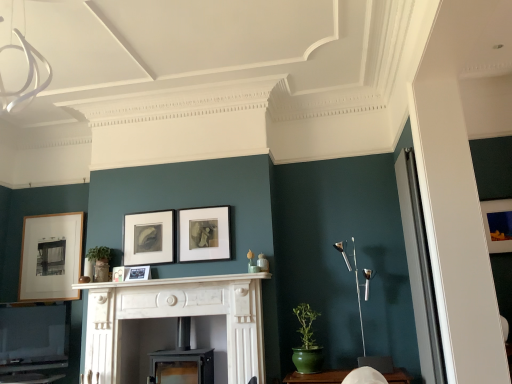
What do you see at coordinates (119, 274) in the screenshot?
I see `matte black picture frame at center, which is counted as the second picture frame, starting from the left` at bounding box center [119, 274].

Describe the element at coordinates (138, 273) in the screenshot. Image resolution: width=512 pixels, height=384 pixels. I see `matte black picture frame at center, the third picture frame viewed from the left` at that location.

How much space does matte black picture frame at center, positioned as the fourth picture frame in left-to-right order, occupy horizontally?

1.71 inches.

You are a GUI agent. You are given a task and a screenshot of the screen. Output one action in this format:
    pyautogui.click(x=<x>, y=<y>)
    Task: Click on the green ceramic table at lower center
    This screenshot has width=512, height=384.
    Given the screenshot: What is the action you would take?
    pyautogui.click(x=316, y=377)

Which point is more forward, (96, 380) or (150, 277)?

The point (96, 380) is closer to the camera.

From the picture: Is white marble fireplace at center, arranged as the first fireplace when viewed from the left, facing away from matte black picture frame at center, the third picture frame viewed from the left?

No, white marble fireplace at center, arranged as the first fireplace when viewed from the left, is not facing away from matte black picture frame at center, the third picture frame viewed from the left.

How different are the orientations of white marble fireplace at center, arranged as the first fireplace when viewed from the left, and matte black picture frame at center, the third picture frame viewed from the left, in degrees?

The angle between the facing direction of white marble fireplace at center, arranged as the first fireplace when viewed from the left, and the facing direction of matte black picture frame at center, the third picture frame viewed from the left, is 2.35 degrees.

In the scene shown: From the image's perspective, which one is positioned lower, white marble fireplace at center, arranged as the first fireplace when viewed from the left, or matte black picture frame at center, the third picture frame viewed from the left?

white marble fireplace at center, arranged as the first fireplace when viewed from the left, from the image's perspective.

This screenshot has width=512, height=384. What are the coordinates of `the 5th picture frame behind when counting from the white marble fireplace at center, the 2th fireplace when ordered from right to left` in the screenshot? It's located at (148, 238).

Does point (173, 237) appear closer or farther from the camera than point (91, 332)?

Point (173, 237) appears to be farther away from the viewer than point (91, 332).

Which object is thinner, matte black picture frame at center, which ranks as the 3th picture frame in right-to-left order, or white marble fireplace at center, arranged as the first fireplace when viewed from the left?

Thinner between the two is matte black picture frame at center, which ranks as the 3th picture frame in right-to-left order.

Considering the sizes of objects green ceramic table at lower center and matte wooden picture frame at right, the first picture frame when ordered from right to left, in the image provided, who is bigger, green ceramic table at lower center or matte wooden picture frame at right, the first picture frame when ordered from right to left,?

Bigger between the two is green ceramic table at lower center.

Is green ceramic table at lower center oriented away from matte wooden picture frame at right, the first picture frame when ordered from right to left?

No, matte wooden picture frame at right, the first picture frame when ordered from right to left, is not at the back of green ceramic table at lower center.

From the image's perspective, which picture frame is the 6th one above the green ceramic table at lower center? Please provide its 2D coordinates.

[(498, 224)]

From a real-world perspective, between green ceramic table at lower center and matte wooden picture frame at right, the first picture frame when ordered from right to left, who is vertically higher?

matte wooden picture frame at right, the first picture frame when ordered from right to left, is physically above.

Based on their sizes in the image, would you say matte black picture frame at center, which is counted as the second picture frame, starting from the left, is bigger or smaller than wooden picture frame at left, positioned as the first picture frame in left-to-right order?

matte black picture frame at center, which is counted as the second picture frame, starting from the left, is smaller than wooden picture frame at left, positioned as the first picture frame in left-to-right order.

This screenshot has height=384, width=512. I want to click on the 2nd picture frame below the wooden picture frame at left, positioned as the first picture frame in left-to-right order (from the image's perspective), so click(x=119, y=274).

Which is less distant, (124, 275) or (50, 251)?

Clearly, point (124, 275) is closer to the camera than point (50, 251).

From the image's perspective, which one is positioned higher, matte black picture frame at center, which is counted as the second picture frame, starting from the left, or wooden picture frame at left, the 6th picture frame from the right?

wooden picture frame at left, the 6th picture frame from the right, appears higher in the image.

From the image's perspective, who appears lower, green ceramic table at lower center or silver metallic floor lamp at right?

From the image's view, green ceramic table at lower center is below.

Considering the relative sizes of green ceramic table at lower center and silver metallic floor lamp at right in the image provided, is green ceramic table at lower center thinner than silver metallic floor lamp at right?

Incorrect, the width of green ceramic table at lower center is not less than that of silver metallic floor lamp at right.

Is green ceramic table at lower center facing towards silver metallic floor lamp at right?

No, green ceramic table at lower center is not aimed at silver metallic floor lamp at right.

From the image's perspective, between white marble fireplace at center, the 2th fireplace when ordered from right to left, and black matte picture frame at center, the fifth picture frame when ordered from left to right, who is located below?

white marble fireplace at center, the 2th fireplace when ordered from right to left, appears lower in the image.

From a real-world perspective, does white marble fireplace at center, arranged as the first fireplace when viewed from the left, stand above black matte picture frame at center, the fifth picture frame when ordered from left to right?

No, from a real-world perspective, white marble fireplace at center, arranged as the first fireplace when viewed from the left, is not above black matte picture frame at center, the fifth picture frame when ordered from left to right.

Is white marble fireplace at center, arranged as the first fireplace when viewed from the left, looking in the opposite direction of black matte picture frame at center, the fifth picture frame when ordered from left to right?

No, white marble fireplace at center, arranged as the first fireplace when viewed from the left, is not facing away from black matte picture frame at center, the fifth picture frame when ordered from left to right.

Can you tell me how much white marble fireplace at center, arranged as the first fireplace when viewed from the left, and black matte picture frame at center, placed as the 2th picture frame when sorted from right to left, differ in facing direction?

They differ by 0.748 degrees in their facing directions.

Is silver metallic floor lamp at right positioned with its back to matte black picture frame at center, the fourth picture frame positioned from the right?

No.

Would you say silver metallic floor lamp at right is outside matte black picture frame at center, the fourth picture frame positioned from the right?

That's correct, silver metallic floor lamp at right is outside of matte black picture frame at center, the fourth picture frame positioned from the right.

Between point (361, 327) and point (135, 279), which one is positioned in front?

Point (361, 327)

The height and width of the screenshot is (384, 512). Identify the location of fireplace that is the 1st object to the right of the matte black picture frame at center, the fourth picture frame positioned from the right, starting at the anchor. (177, 316).

Locate an element on the screen. This screenshot has height=384, width=512. the 1st fireplace directly beneath the matte black picture frame at center, positioned as the fourth picture frame in left-to-right order (from a real-world perspective) is located at coordinates (177, 316).

Considering their positions, is wooden picture frame at left, the 6th picture frame from the right, positioned closer to white marble fireplace at center, the 2th fireplace when ordered from right to left, than white marble fireplace at center?

white marble fireplace at center is positioned closer to the anchor white marble fireplace at center, the 2th fireplace when ordered from right to left.

Based on their spatial positions, is matte wooden picture frame at right, placed as the 6th picture frame when sorted from left to right, or white marble fireplace at center, arranged as the first fireplace when viewed from the left, closer to white marble fireplace at center?

Among the two, white marble fireplace at center, arranged as the first fireplace when viewed from the left, is located nearer to white marble fireplace at center.

Looking at the image, which one is located closer to matte black fireplace at center, arranged as the second fireplace when viewed from the left, matte black picture frame at center, which is counted as the second picture frame, starting from the left, or black matte picture frame at center, placed as the 2th picture frame when sorted from right to left?

black matte picture frame at center, placed as the 2th picture frame when sorted from right to left, is closer to matte black fireplace at center, arranged as the second fireplace when viewed from the left.

Looking at the image, which one is located closer to silver metallic floor lamp at right, matte black fireplace at center, arranged as the second fireplace when viewed from the left, or white marble fireplace at center, arranged as the first fireplace when viewed from the left?

white marble fireplace at center, arranged as the first fireplace when viewed from the left, lies closer to silver metallic floor lamp at right than the other object.

Which object lies nearer to the anchor point matte black fireplace at center, which is the first fireplace from right to left, white marble fireplace at center, arranged as the first fireplace when viewed from the left, or black matte picture frame at center, placed as the 2th picture frame when sorted from right to left?

white marble fireplace at center, arranged as the first fireplace when viewed from the left, is closer to matte black fireplace at center, which is the first fireplace from right to left.

Looking at the image, which one is located further to green ceramic table at lower center, matte black picture frame at center, the third picture frame viewed from the left, or black matte picture frame at center, the fifth picture frame when ordered from left to right?

matte black picture frame at center, the third picture frame viewed from the left.

When comparing their distances from black matte picture frame at center, the fifth picture frame when ordered from left to right, does matte black fireplace at center, arranged as the second fireplace when viewed from the left, or matte wooden picture frame at right, the first picture frame when ordered from right to left, seem further?

matte wooden picture frame at right, the first picture frame when ordered from right to left, is positioned further to the anchor black matte picture frame at center, the fifth picture frame when ordered from left to right.

When comparing their distances from matte black picture frame at center, positioned as the fourth picture frame in left-to-right order, does black matte picture frame at center, placed as the 2th picture frame when sorted from right to left, or white marble fireplace at center seem closer?

Among the two, black matte picture frame at center, placed as the 2th picture frame when sorted from right to left, is located nearer to matte black picture frame at center, positioned as the fourth picture frame in left-to-right order.

Identify the location of fireplace located between white marble fireplace at center, arranged as the first fireplace when viewed from the left, and silver metallic floor lamp at right in the left-right direction. (182, 361).

The image size is (512, 384). I want to click on mantle between matte black picture frame at center, which ranks as the 3th picture frame in right-to-left order, and silver metallic floor lamp at right from left to right, so click(x=176, y=281).

At what (x,y) coordinates should I click in order to perform the action: click on table located between black matte picture frame at center, placed as the 2th picture frame when sorted from right to left, and silver metallic floor lamp at right in the left-right direction. Please return your answer as a coordinate pair (x, y). Image resolution: width=512 pixels, height=384 pixels. Looking at the image, I should click on (316, 377).

The width and height of the screenshot is (512, 384). I want to click on mantle between matte black picture frame at center, which ranks as the 3th picture frame in right-to-left order, and black matte picture frame at center, the fifth picture frame when ordered from left to right, in the horizontal direction, so click(x=176, y=281).